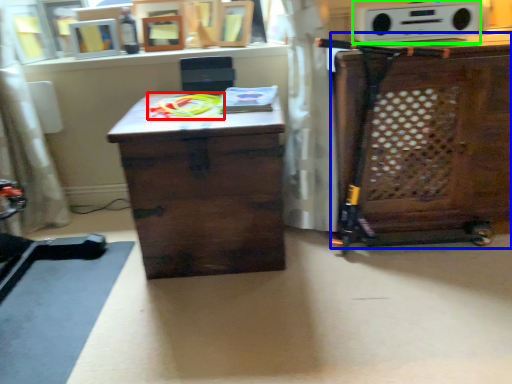
Question: Which object is positioned closest to toy (highlighted by a red box)? Select from cabinetry (highlighted by a blue box) and stereo (highlighted by a green box).

Choices:
 (A) cabinetry
 (B) stereo

Answer: (B)